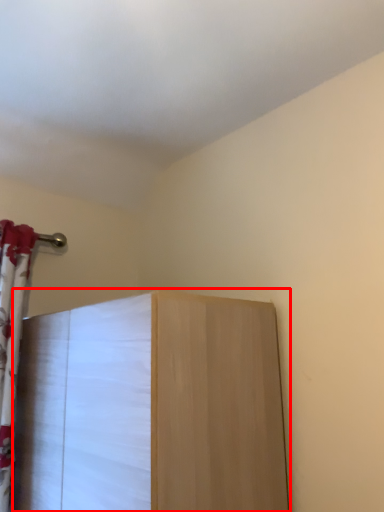
Question: Observing the image, what is the correct spatial positioning of furniture (annotated by the red box) in reference to curtain?

Choices:
 (A) left
 (B) right

Answer: (B)